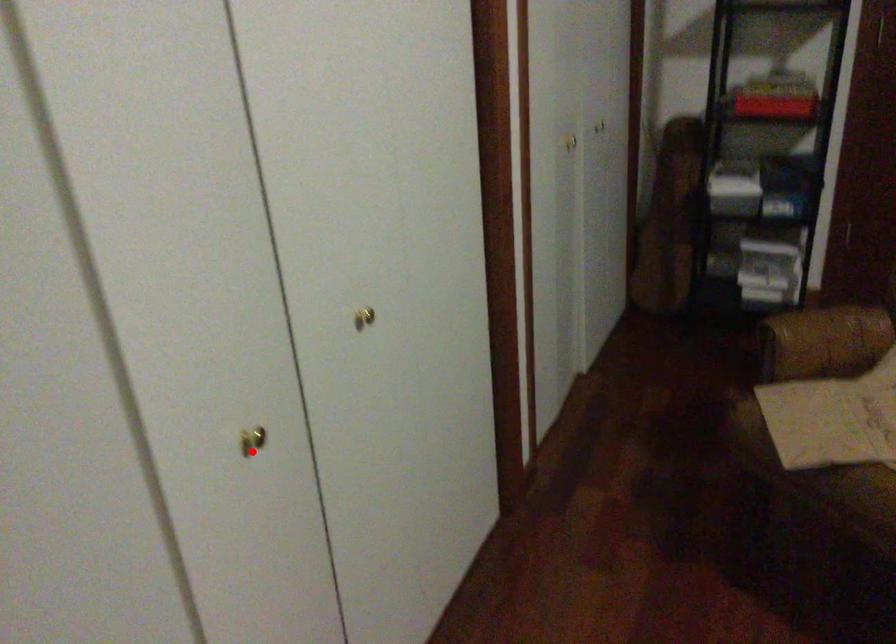
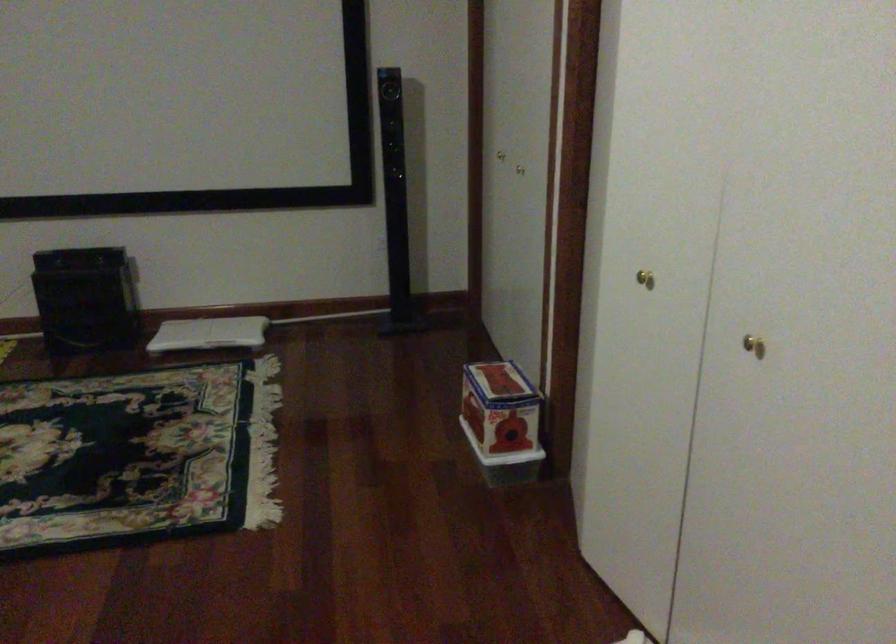
Locate, in the second image, the point that corresponds to the highlighted location in the first image.

(644, 279)